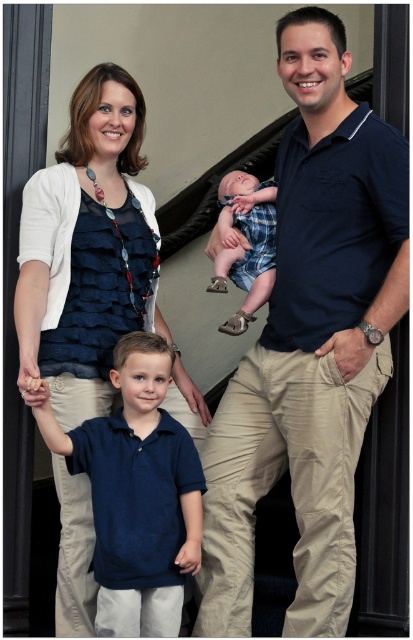
Consider the image. Is the position of matte blue polo shirt at lower left more distant than that of plaid fabric baby at center?

No, it is not.

Consider the image. Who is lower down, matte blue polo shirt at lower left or plaid fabric baby at center?

matte blue polo shirt at lower left is below.

Does point (94, 428) come farther from viewer compared to point (222, 221)?

No, (94, 428) is in front of (222, 221).

You are a GUI agent. You are given a task and a screenshot of the screen. Output one action in this format:
    pyautogui.click(x=<x>, y=<y>)
    Task: Click on the matte blue polo shirt at lower left
    This screenshot has height=640, width=413.
    Given the screenshot: What is the action you would take?
    pyautogui.click(x=137, y=492)

Based on the photo, is dark blue polo shirt at center to the right of matte blue blouse at center from the viewer's perspective?

Correct, you'll find dark blue polo shirt at center to the right of matte blue blouse at center.

Which is above, dark blue polo shirt at center or matte blue blouse at center?

dark blue polo shirt at center is above.

The width and height of the screenshot is (413, 640). I want to click on dark blue polo shirt at center, so click(x=310, y=342).

Image resolution: width=413 pixels, height=640 pixels. I want to click on dark blue polo shirt at center, so click(x=310, y=342).

Does dark blue polo shirt at center appear on the right side of matte blue polo shirt at lower left?

Indeed, dark blue polo shirt at center is positioned on the right side of matte blue polo shirt at lower left.

Which is behind, point (298, 504) or point (158, 604)?

The point (298, 504) is behind.

This screenshot has height=640, width=413. Identify the location of dark blue polo shirt at center. (310, 342).